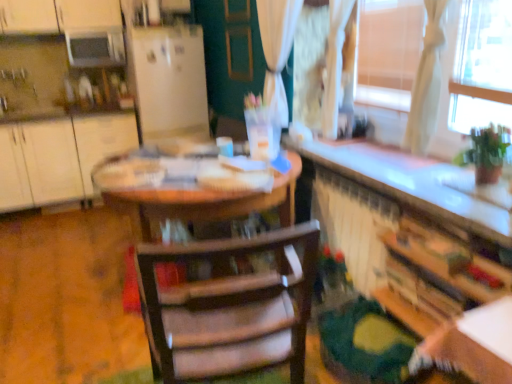
Question: Is white matte cabinet at left, which is the first cabinetry from back to front, not within matte brown screen door at center?

Choices:
 (A) yes
 (B) no

Answer: (A)

Question: Are white matte cabinet at left, the 1th cabinetry positioned from the left, and matte brown screen door at center far apart?

Choices:
 (A) yes
 (B) no

Answer: (A)

Question: Is white matte cabinet at left, arranged as the 2th cabinetry when viewed from the right, to the right of matte brown screen door at center from the viewer's perspective?

Choices:
 (A) yes
 (B) no

Answer: (B)

Question: Is white matte cabinet at left, the 1th cabinetry positioned from the left, next to matte brown screen door at center and touching it?

Choices:
 (A) no
 (B) yes

Answer: (A)

Question: Considering the relative sizes of white matte cabinet at left, arranged as the 2th cabinetry when viewed from the right, and matte brown screen door at center in the image provided, is white matte cabinet at left, arranged as the 2th cabinetry when viewed from the right, smaller than matte brown screen door at center?

Choices:
 (A) no
 (B) yes

Answer: (A)

Question: In terms of height, does white matte refrigerator at center look taller or shorter compared to white matte cabinet at left, which is the first cabinetry from back to front?

Choices:
 (A) short
 (B) tall

Answer: (B)

Question: Based on their positions, is white matte refrigerator at center located to the left or right of white matte cabinet at left, the 1th cabinetry positioned from the left?

Choices:
 (A) right
 (B) left

Answer: (A)

Question: Is white matte refrigerator at center inside or outside of white matte cabinet at left, which is the first cabinetry from back to front?

Choices:
 (A) outside
 (B) inside

Answer: (A)

Question: From the image's perspective, relative to white matte cabinet at left, which is the first cabinetry in top-to-bottom order, is white matte refrigerator at center above or below?

Choices:
 (A) above
 (B) below

Answer: (A)

Question: Is matte brown screen door at center spatially inside wooden chair at center, or outside of it?

Choices:
 (A) outside
 (B) inside

Answer: (A)

Question: Is matte brown screen door at center taller or shorter than wooden chair at center?

Choices:
 (A) tall
 (B) short

Answer: (B)

Question: From a real-world perspective, relative to wooden chair at center, is matte brown screen door at center vertically above or below?

Choices:
 (A) below
 (B) above

Answer: (B)

Question: Does point (234, 36) appear closer or farther from the camera than point (268, 354)?

Choices:
 (A) closer
 (B) farther

Answer: (B)

Question: Is white matte cabinet at left, the 1th cabinetry positioned from the left, taller or shorter than wooden chair at center?

Choices:
 (A) tall
 (B) short

Answer: (B)

Question: Relative to wooden chair at center, is white matte cabinet at left, which is the first cabinetry in top-to-bottom order, in front or behind?

Choices:
 (A) front
 (B) behind

Answer: (B)